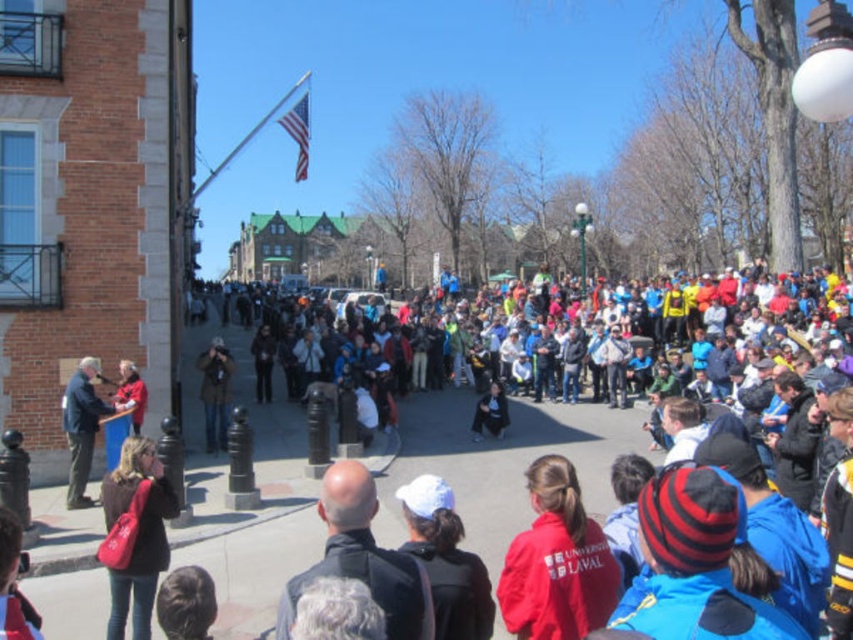
You are a photographer trying to capture a group photo of the crowd in the public square. You want to ensure both the red fleece jacket at center and the matte brown jacket at lower left are visible in the frame. Based on their heights, which jacket might you need to adjust your camera angle to better include in the shot?

The red fleece jacket at center is not as tall as the matte brown jacket at lower left, so you might need to lower your camera angle to ensure the shorter red fleece jacket at center is fully visible in the frame.

You are standing at the point marked by the coordinates point [137,534]. Looking around, you see a crowd of people. Which direction should you walk to find the matte brown jacket at lower left?

The point [137,534] is already at the location of the matte brown jacket at lower left, so you are already at the correct position.

You are standing at the back of the crowd and want to see the person in the red fleece jacket at center. Is the dark blue jacket at left blocking your view?

The red fleece jacket at center is in front of the dark blue jacket at left, so the dark blue jacket at left is behind it and not blocking your view. You should be able to see the red fleece jacket at center without any obstruction from the dark blue jacket at left.